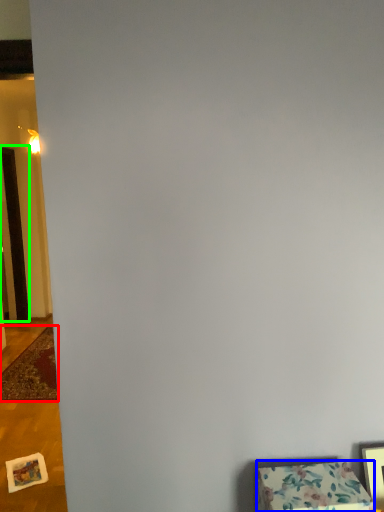
Question: Based on their relative distances, which object is farther from mat (highlighted by a red box)? Choose from furniture (highlighted by a blue box) and door (highlighted by a green box).

Choices:
 (A) furniture
 (B) door

Answer: (A)